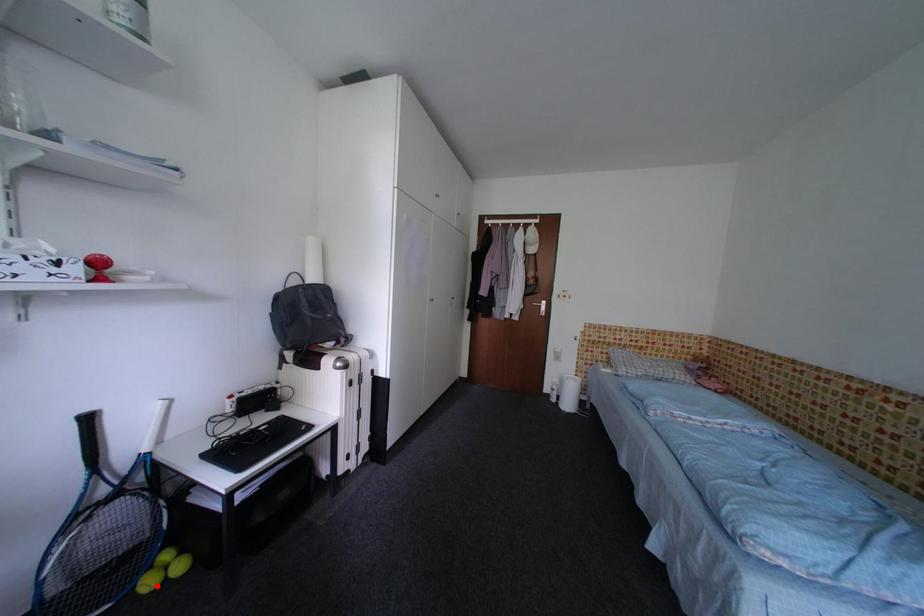
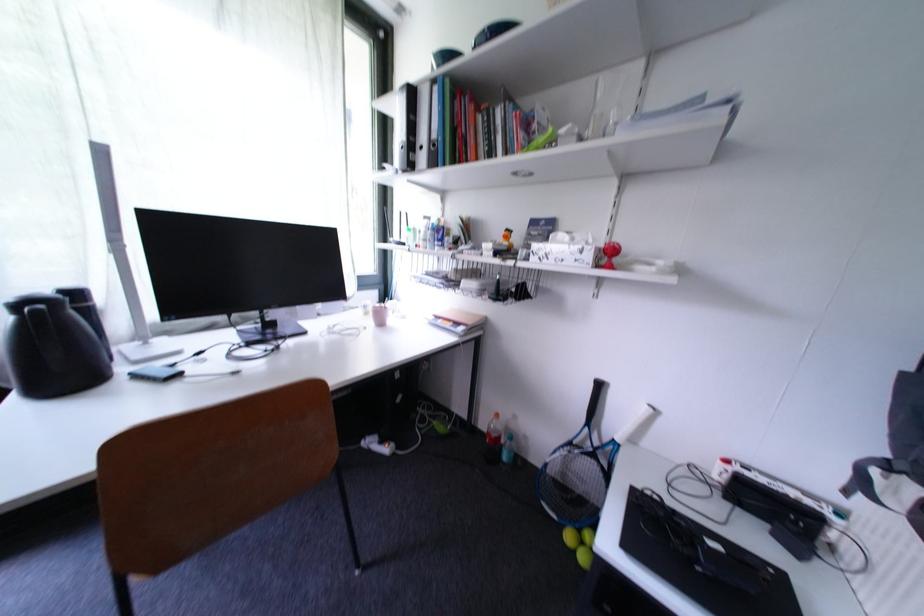
Question: I am providing you with two images of the same scene from different viewpoints. In image1, a red point is highlighted. Considering the same 3D point in image2, which of the following is correct?

Choices:
 (A) It is closer
 (B) It is farther

Answer: (B)